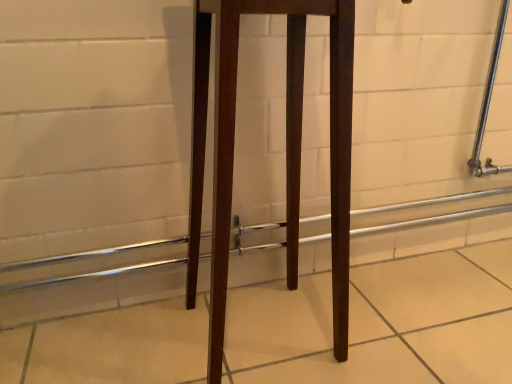
Locate an element on the screen. vacant space underneath dark wood chair at center (from a real-world perspective) is located at coordinates (268, 341).